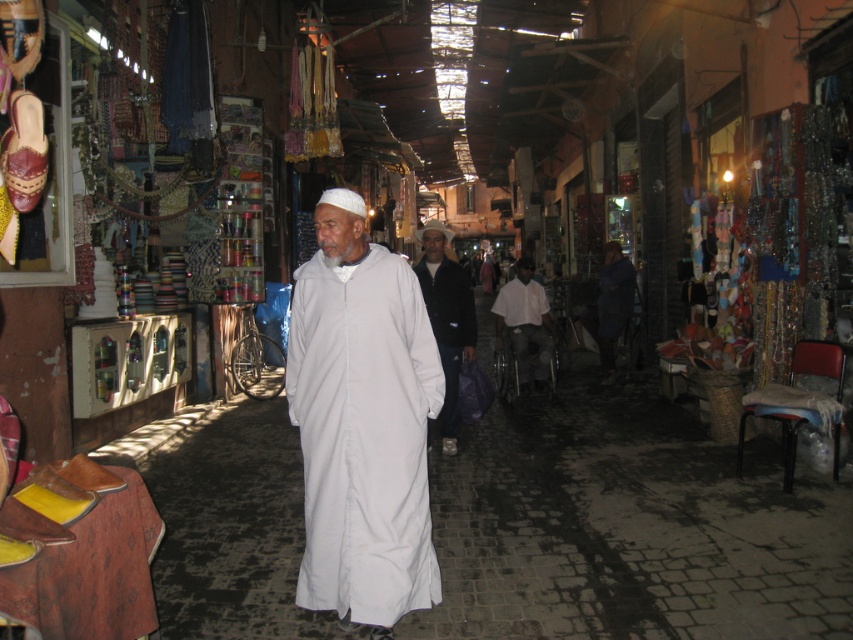
You are standing at the entrance of the market and see two points marked in the scene. The first point is at coordinates point (373, 509) and the second is at point (518, 269). Which point is closer to you?

Point (373, 509) is in front of point (518, 269), so the first point is closer to you.